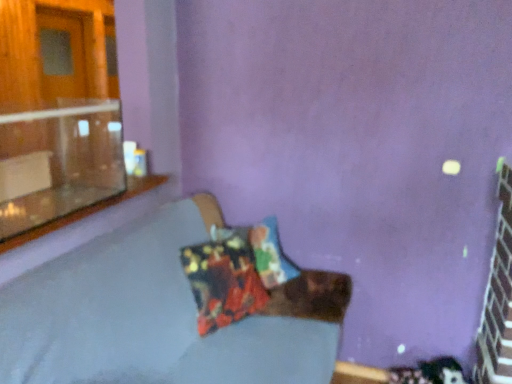
Find the location of a particular element. The image size is (512, 384). textured fabric couch at center is located at coordinates (172, 309).

In order to face textured fabric couch at center, should I rotate leftwards or rightwards?

You should look left and rotate roughly 5.125 degrees.

The width and height of the screenshot is (512, 384). What do you see at coordinates (84, 211) in the screenshot? I see `clear glass window sill at upper left` at bounding box center [84, 211].

In the scene shown: What is the approximate width of clear glass window sill at upper left?

clear glass window sill at upper left is 12.16 inches wide.

Describe the element at coordinates (58, 162) in the screenshot. The height and width of the screenshot is (384, 512). I see `transparent glass window at upper left` at that location.

Image resolution: width=512 pixels, height=384 pixels. In order to click on textured fabric couch at center in this screenshot , I will do `click(172, 309)`.

Does point (329, 341) come behind point (5, 224)?

Yes, point (329, 341) is farther from viewer.

Is textured fabric couch at center not near transparent glass window at upper left?

They are positioned close to each other.

Is textured fabric couch at center aimed at transparent glass window at upper left?

No, textured fabric couch at center is not turned towards transparent glass window at upper left.

This screenshot has width=512, height=384. I want to click on studio couch below the transparent glass window at upper left (from the image's perspective), so click(x=172, y=309).

Looking at this image, between clear glass window sill at upper left and printed fabric pillow at center, which one has less height?

clear glass window sill at upper left.

In the scene shown: Is clear glass window sill at upper left placed right next to printed fabric pillow at center?

No, clear glass window sill at upper left is not making contact with printed fabric pillow at center.

Does point (144, 183) come closer to viewer compared to point (209, 246)?

Yes, point (144, 183) is closer to viewer.

Which object is further away from the camera, clear glass window sill at upper left or printed fabric pillow at center?

printed fabric pillow at center is further from the camera.

Does point (196, 304) come in front of point (280, 373)?

No.

From a real-world perspective, who is located higher, printed fabric pillow at center or textured fabric couch at center?

printed fabric pillow at center.

Looking at this image, is textured fabric couch at center inside printed fabric pillow at center?

No.

Does printed fabric pillow at center have a greater height compared to textured fabric couch at center?

Incorrect, the height of printed fabric pillow at center is not larger of that of textured fabric couch at center.

From a real-world perspective, which is physically below, textured fabric couch at center or printed fabric pillow at center?

In real-world perspective, textured fabric couch at center is lower.

Does point (149, 237) come behind point (199, 246)?

No, it is not.

Considering the relative sizes of textured fabric couch at center and printed fabric pillow at center in the image provided, is textured fabric couch at center smaller than printed fabric pillow at center?

No.

How many degrees apart are the facing directions of textured fabric couch at center and printed fabric pillow at center?

33.2 degrees.

Is printed fabric pillow at center completely or partially inside transparent glass window at upper left?

No, printed fabric pillow at center is not a part of transparent glass window at upper left.

In terms of height, does transparent glass window at upper left look taller or shorter compared to printed fabric pillow at center?

transparent glass window at upper left is shorter than printed fabric pillow at center.

Image resolution: width=512 pixels, height=384 pixels. I want to click on window on the left of the printed fabric pillow at center, so click(x=58, y=162).

Is transparent glass window at upper left thinner than printed fabric pillow at center?

No, transparent glass window at upper left is not thinner than printed fabric pillow at center.

Is printed fabric pillow at center next to transparent glass window at upper left?

No.

Considering the sizes of printed fabric pillow at center and transparent glass window at upper left in the image, is printed fabric pillow at center bigger or smaller than transparent glass window at upper left?

In the image, printed fabric pillow at center appears to be smaller than transparent glass window at upper left.

What's the angular difference between printed fabric pillow at center and transparent glass window at upper left's facing directions?

148 degrees separate the facing orientations of printed fabric pillow at center and transparent glass window at upper left.

Is clear glass window sill at upper left touching transparent glass window at upper left?

No, clear glass window sill at upper left is not beside transparent glass window at upper left.

Does clear glass window sill at upper left come behind transparent glass window at upper left?

Yes, it is.

Does point (80, 212) appear closer or farther from the camera than point (7, 150)?

Point (80, 212) is positioned closer to the camera compared to point (7, 150).

Could you measure the distance between clear glass window sill at upper left and transparent glass window at upper left?

clear glass window sill at upper left is 37.82 centimeters from transparent glass window at upper left.

What are the coordinates of `studio couch in front of the transparent glass window at upper left` in the screenshot? It's located at (172, 309).

Find the location of a particular element. pillow that appears below the clear glass window sill at upper left (from a real-world perspective) is located at coordinates (223, 280).

Which object lies further to the anchor point textured fabric couch at center, clear glass window sill at upper left or transparent glass window at upper left?

The object further to textured fabric couch at center is transparent glass window at upper left.

Which object lies further to the anchor point clear glass window sill at upper left, textured fabric couch at center or printed fabric pillow at center?

Based on the image, printed fabric pillow at center appears to be further to clear glass window sill at upper left.

In the scene shown: Looking at the image, which one is located closer to printed fabric pillow at center, clear glass window sill at upper left or transparent glass window at upper left?

clear glass window sill at upper left lies closer to printed fabric pillow at center than the other object.

When comparing their distances from textured fabric couch at center, does transparent glass window at upper left or printed fabric pillow at center seem closer?

printed fabric pillow at center is closer to textured fabric couch at center.

Looking at the image, which one is located further to textured fabric couch at center, clear glass window sill at upper left or printed fabric pillow at center?

clear glass window sill at upper left.

Considering their positions, is textured fabric couch at center positioned further to printed fabric pillow at center than clear glass window sill at upper left?

Among the two, clear glass window sill at upper left is located further to printed fabric pillow at center.

Considering their positions, is printed fabric pillow at center positioned further to textured fabric couch at center than clear glass window sill at upper left?

clear glass window sill at upper left lies further to textured fabric couch at center than the other object.

Estimate the real-world distances between objects in this image. Which object is further from clear glass window sill at upper left, transparent glass window at upper left or textured fabric couch at center?

Based on the image, textured fabric couch at center appears to be further to clear glass window sill at upper left.

Where is `window sill between textured fabric couch at center and printed fabric pillow at center in the front-back direction`? The image size is (512, 384). window sill between textured fabric couch at center and printed fabric pillow at center in the front-back direction is located at coordinates (84, 211).

This screenshot has height=384, width=512. In order to click on window sill between transparent glass window at upper left and textured fabric couch at center in the up-down direction in this screenshot , I will do `click(84, 211)`.

You are a GUI agent. You are given a task and a screenshot of the screen. Output one action in this format:
    pyautogui.click(x=<x>, y=<y>)
    Task: Click on the window sill between transparent glass window at upper left and printed fabric pillow at center in the horizontal direction
    
    Given the screenshot: What is the action you would take?
    pyautogui.click(x=84, y=211)

The height and width of the screenshot is (384, 512). I want to click on window between textured fabric couch at center and printed fabric pillow at center along the z-axis, so click(x=58, y=162).